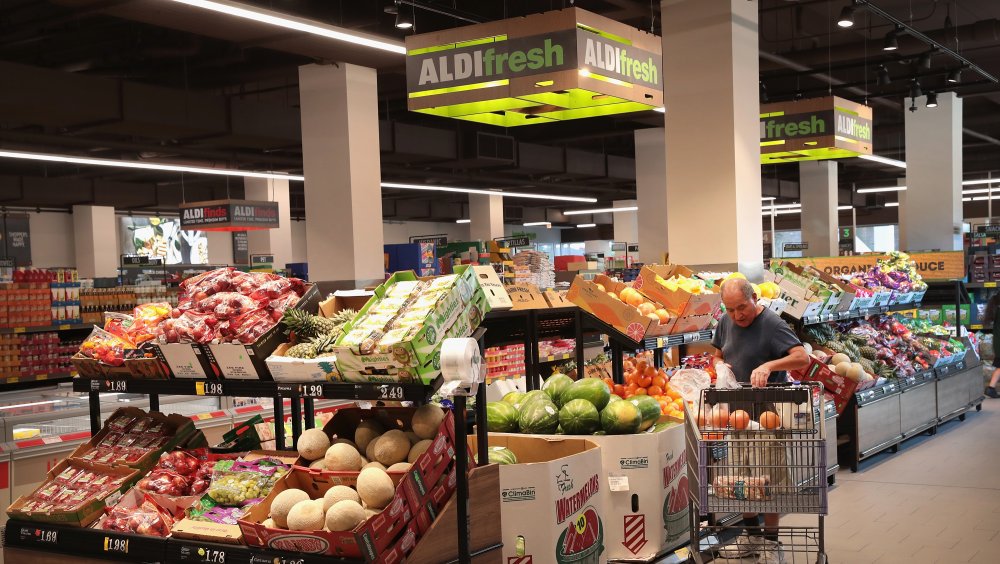
In order to click on fluorescent lights in this screenshot , I will do `click(107, 161)`, `click(304, 25)`, `click(449, 190)`, `click(776, 212)`, `click(872, 189)`, `click(970, 201)`, `click(974, 193)`, `click(970, 182)`, `click(878, 161)`, `click(609, 208)`.